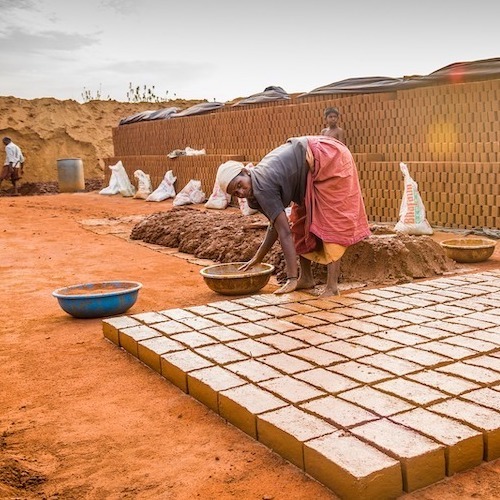
Locate an element on the screen. This screenshot has height=500, width=500. bowl is located at coordinates point(107,309), point(238,285).